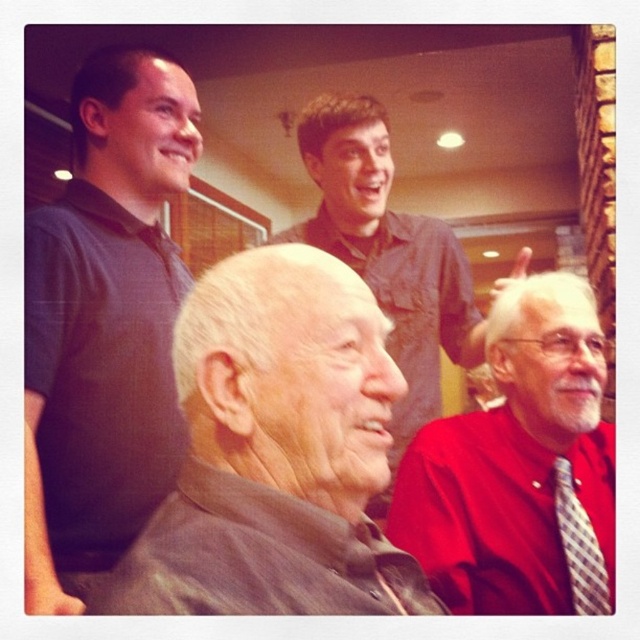
Question: Is red smooth shirt at lower right closer to camera compared to denim shirt at upper center?

Choices:
 (A) yes
 (B) no

Answer: (A)

Question: Does brown leather jacket at center appear on the right side of dark gray polo shirt at upper left?

Choices:
 (A) no
 (B) yes

Answer: (B)

Question: Which point is farther to the camera?

Choices:
 (A) brown leather jacket at center
 (B) red smooth shirt at lower right

Answer: (B)

Question: Based on their relative distances, which object is farther from the red smooth shirt at lower right?

Choices:
 (A) plaid fabric tie at right
 (B) dark gray polo shirt at upper left

Answer: (B)

Question: Does brown leather jacket at center appear on the right side of dark gray polo shirt at upper left?

Choices:
 (A) no
 (B) yes

Answer: (B)

Question: Among these points, which one is nearest to the camera?

Choices:
 (A) 150,257
 (B) 582,582
 (C) 472,499

Answer: (B)